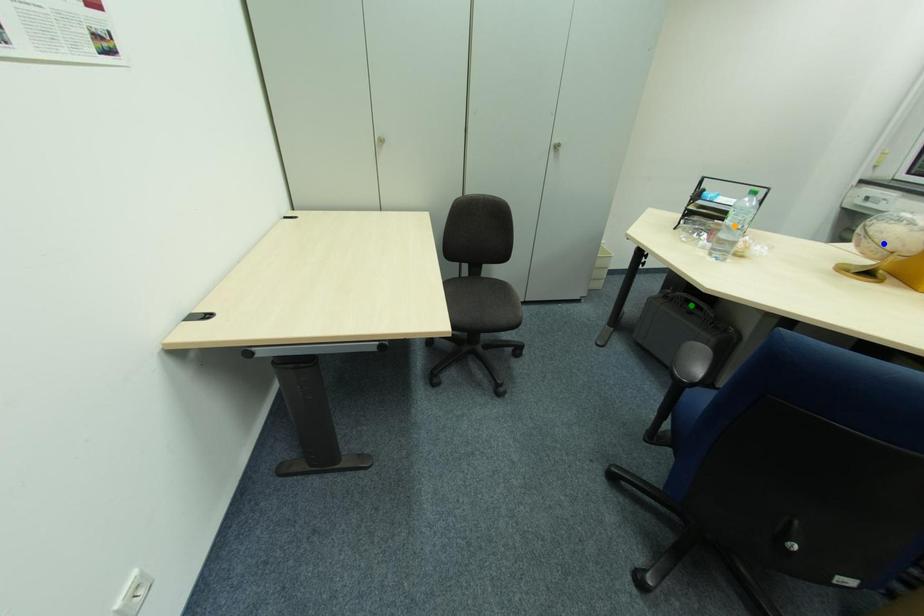
Order these from nearest to farthest:
green point
blue point
orange point

orange point
green point
blue point